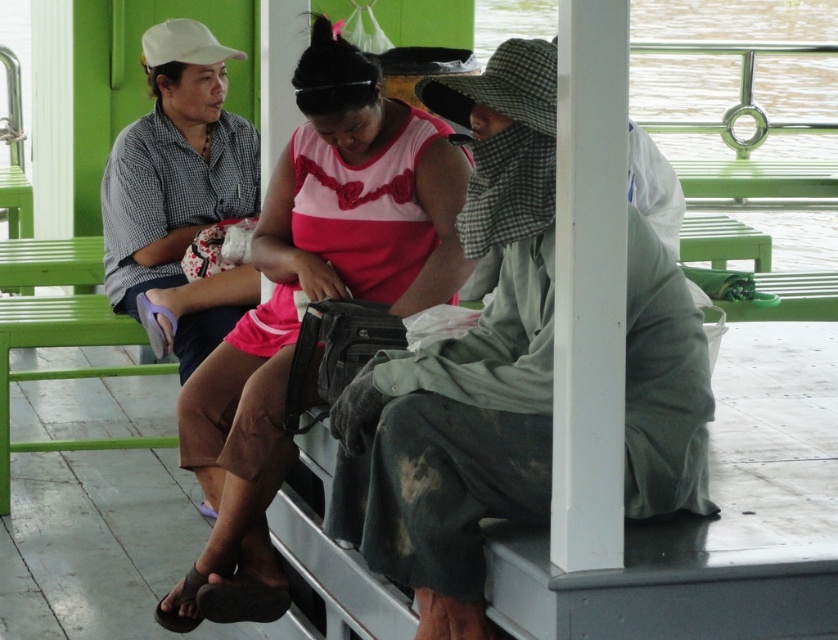
Question: Can you confirm if green fabric hat at center is positioned to the left of pink matte dress at center?

Choices:
 (A) no
 (B) yes

Answer: (A)

Question: Among these objects, which one is farthest from the camera?

Choices:
 (A) pink matte dress at center
 (B) green fabric hat at center

Answer: (A)

Question: Which point appears farthest from the camera in this image?

Choices:
 (A) (546, 467)
 (B) (332, 70)

Answer: (B)

Question: Can you confirm if green fabric hat at center is bigger than pink matte dress at center?

Choices:
 (A) yes
 (B) no

Answer: (B)

Question: Does green fabric hat at center have a smaller size compared to pink matte dress at center?

Choices:
 (A) yes
 (B) no

Answer: (A)

Question: Which object appears closest to the camera in this image?

Choices:
 (A) pink matte dress at center
 (B) green fabric hat at center

Answer: (B)